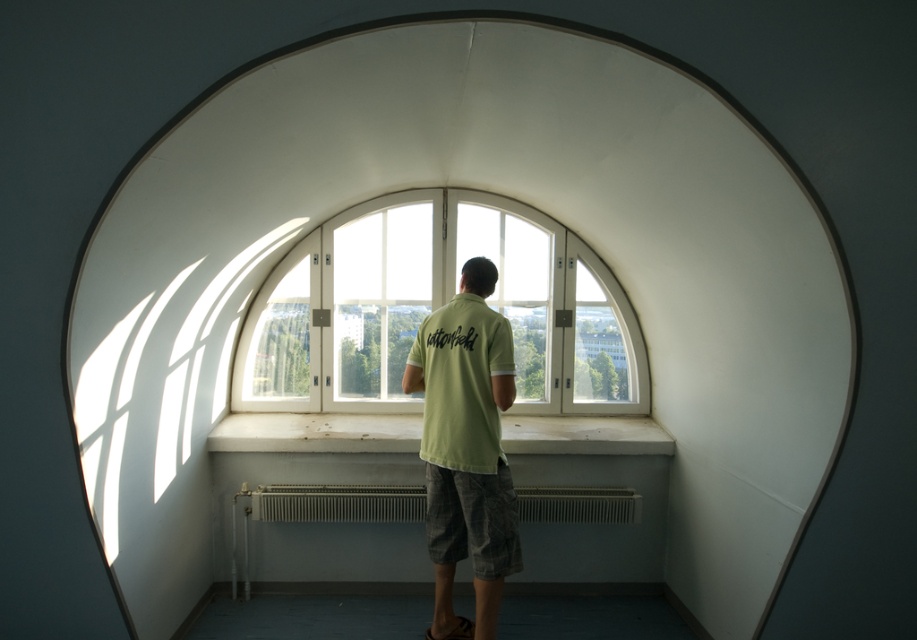
You are standing in the room shown in the image and want to move closer to the point at coordinates (473, 636). If you take a step forward, will you be within 2 meters of that point?

The point at coordinates (473, 636) is currently 3.23 meters away from you. Taking a single step forward would likely reduce the distance, but unless the step covers at least 1.23 meters, you won